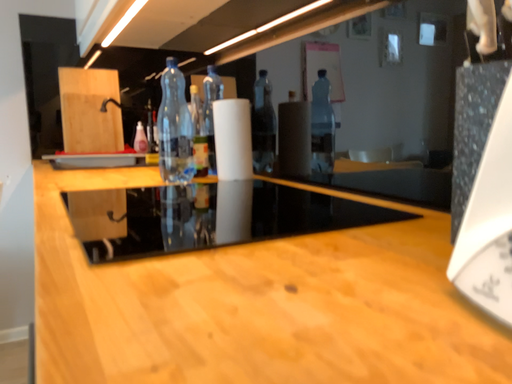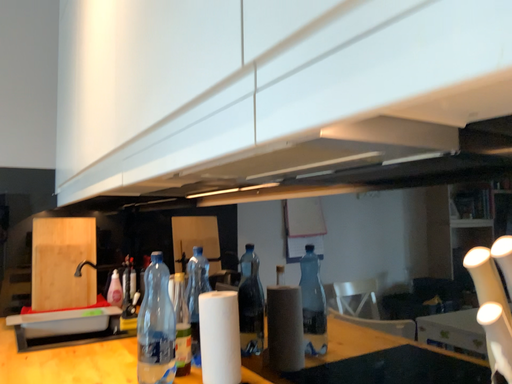
Question: How did the camera likely rotate when shooting the video?

Choices:
 (A) rotated downward
 (B) rotated upward

Answer: (B)